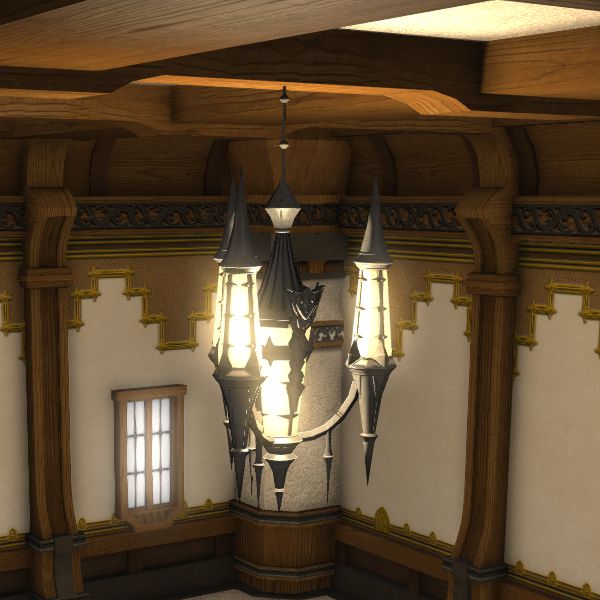
I want to click on gold trim, so click(173, 278), click(409, 284), click(533, 280), click(12, 274), click(207, 507), click(381, 516), click(553, 580), click(10, 530), click(93, 520).